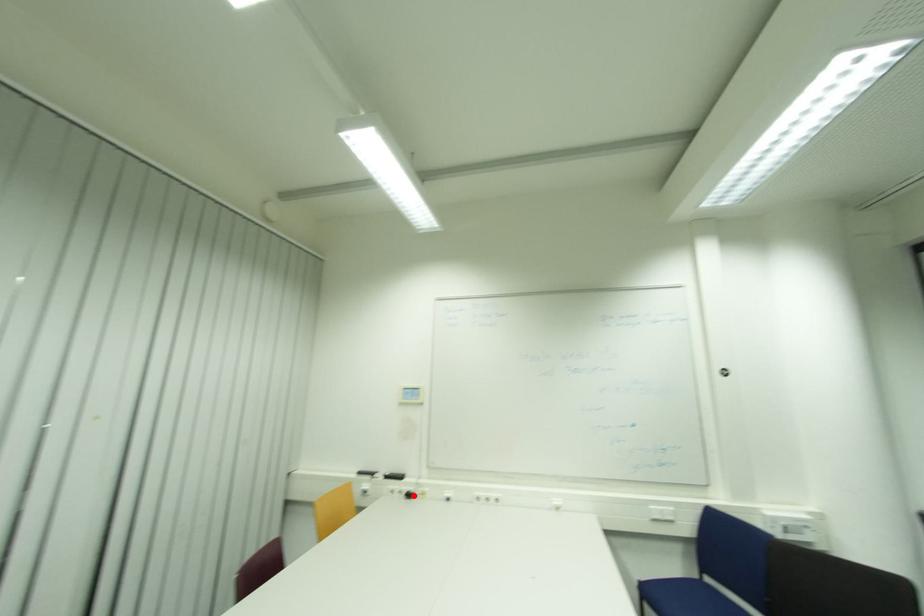
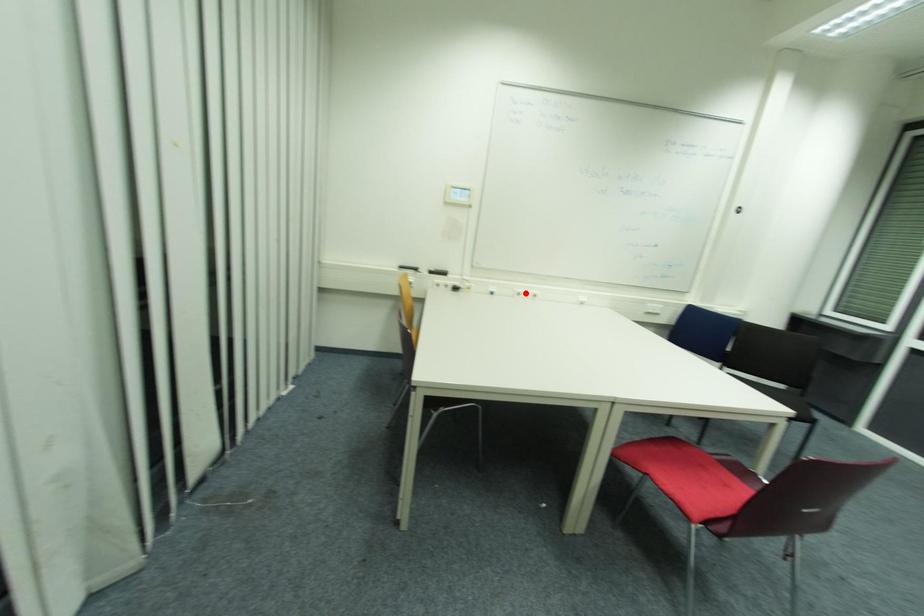
I am providing you with two images of the same scene from different viewpoints. A red point is marked on the first image and another point is marked on the second image. Does the point marked in image1 correspond to the same location as the one in image2?

No